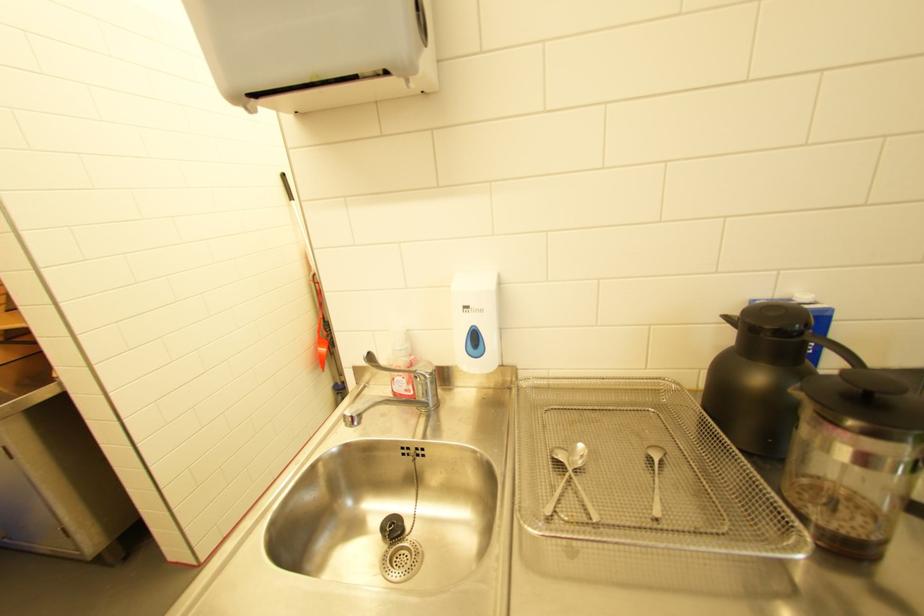
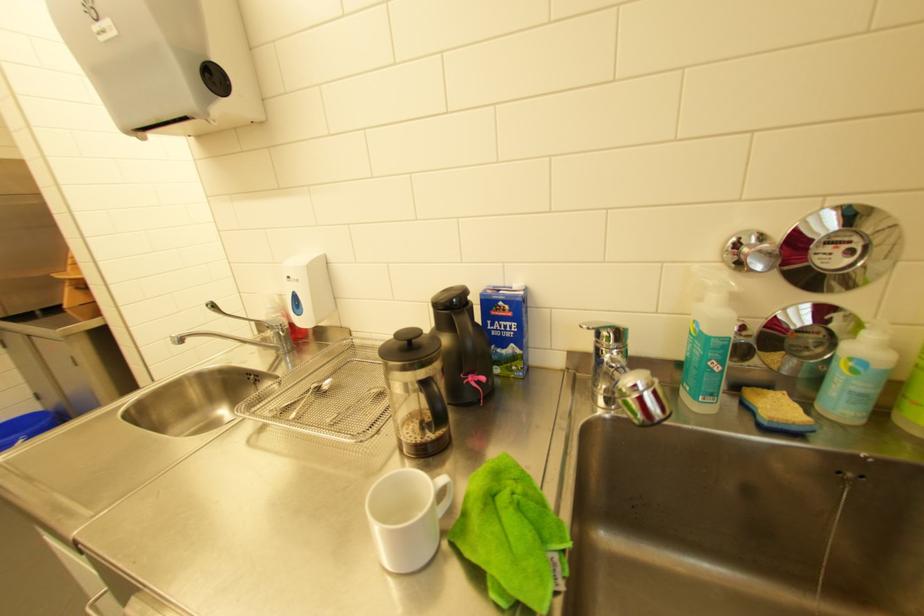
Question: What movement of the cameraman would produce the second image?

Choices:
 (A) Left
 (B) Right
 (C) Forward
 (D) Backward

Answer: (B)